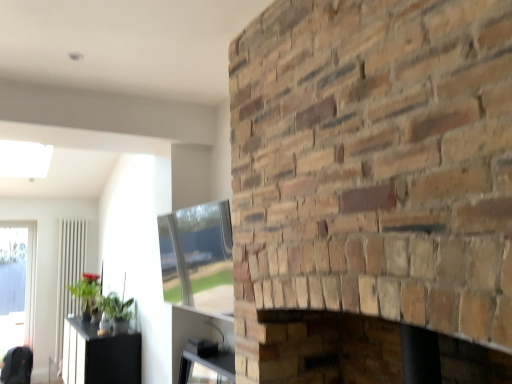
Question: From the image's perspective, relative to white glossy radiator at left, is green leafy plant at lower left, the first plant when ordered from front to back, above or below?

Choices:
 (A) below
 (B) above

Answer: (B)

Question: Is point (115, 309) closer or farther from the camera than point (65, 263)?

Choices:
 (A) closer
 (B) farther

Answer: (A)

Question: Which of these objects is positioned farthest from the natural stone fireplace at center?

Choices:
 (A) green matte plant at left, the 2th plant viewed from the right
 (B) dark gray fabric swivel chair at lower left
 (C) black glossy table at lower left
 (D) white glossy radiator at left
 (E) transparent glass door at left

Answer: (B)

Question: Which object is the closest to the green matte plant at left, the 2th plant viewed from the right?

Choices:
 (A) green leafy plant at lower left, the first plant when ordered from front to back
 (B) black glossy table at lower left
 (C) white glossy radiator at left
 (D) natural stone fireplace at center
 (E) transparent glass door at left

Answer: (A)